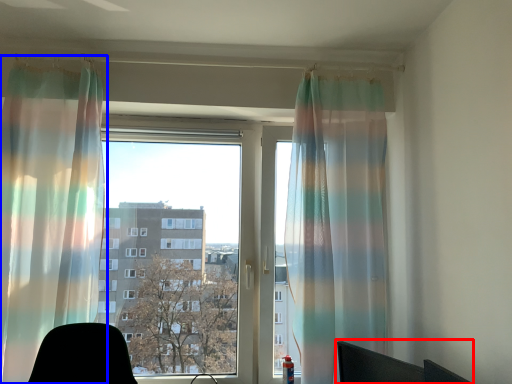
Question: Among these objects, which one is farthest to the camera, computer chair (highlighted by a red box) or curtain (highlighted by a blue box)?

Choices:
 (A) computer chair
 (B) curtain

Answer: (B)